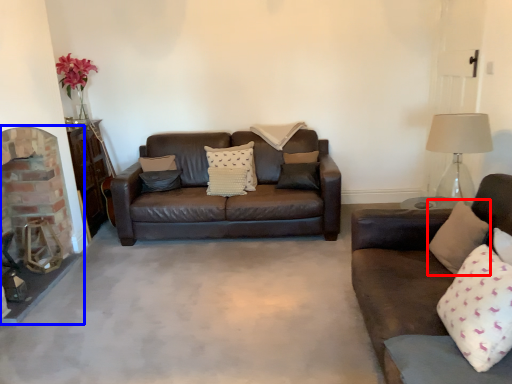
Question: Which of the following is the closest to the observer, pillow (highlighted by a red box) or fireplace (highlighted by a blue box)?

Choices:
 (A) pillow
 (B) fireplace

Answer: (A)